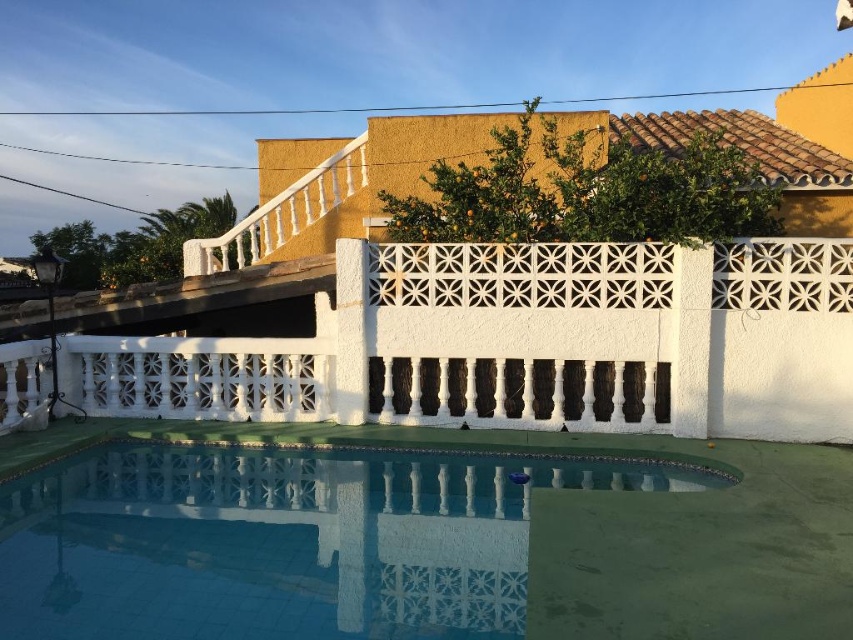
Question: Which point is farther to the camera?

Choices:
 (A) (801, 294)
 (B) (228, 458)

Answer: (A)

Question: Can you confirm if yellow stucco villa at upper center is thinner than blue tile swimming pool at lower center?

Choices:
 (A) yes
 (B) no

Answer: (B)

Question: Can you confirm if yellow stucco villa at upper center is positioned to the left of blue tile swimming pool at lower center?

Choices:
 (A) yes
 (B) no

Answer: (B)

Question: Can you confirm if yellow stucco villa at upper center is positioned below blue tile swimming pool at lower center?

Choices:
 (A) no
 (B) yes

Answer: (A)